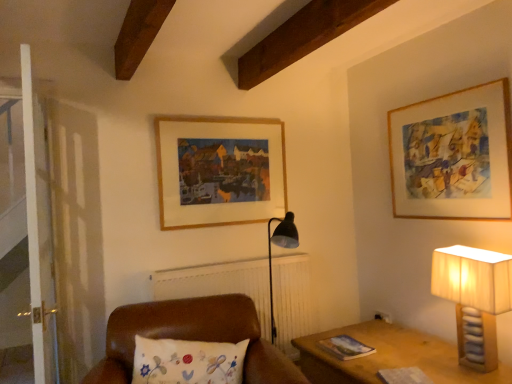
This screenshot has width=512, height=384. What are the coordinates of `vacant point above wooden picture frame at upper center, placed as the first picture frame when sorted from left to right (from a real-world perspective)` in the screenshot? It's located at (220, 120).